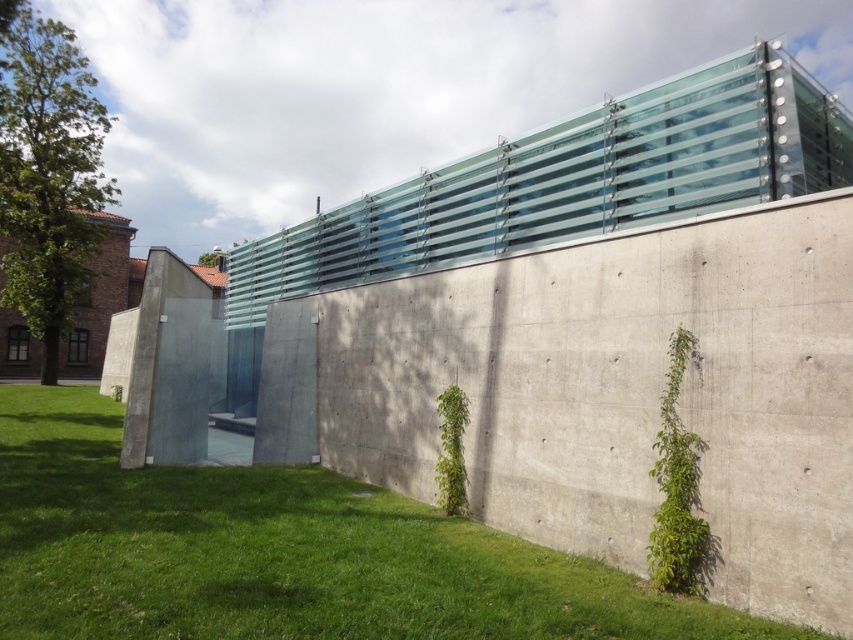
Between green leafy ivy at lower right and green leafy ivy at center, which one appears on the right side from the viewer's perspective?

green leafy ivy at lower right

From the picture: Which is below, green leafy ivy at lower right or green leafy ivy at center?

green leafy ivy at center is lower down.

Which is in front, point (689, 492) or point (445, 413)?

Point (689, 492) is in front.

The height and width of the screenshot is (640, 853). Identify the location of green leafy ivy at lower right. (677, 490).

Is point (238, 500) positioned behind point (437, 412)?

No.

Who is positioned more to the right, green grass at lower left or green leafy ivy at center?

green leafy ivy at center

The height and width of the screenshot is (640, 853). I want to click on green grass at lower left, so click(280, 552).

Identify the location of green grass at lower left. The width and height of the screenshot is (853, 640). 280,552.

Consider the image. Who is taller, green grass at lower left or green leafy ivy at lower right?

With more height is green leafy ivy at lower right.

Looking at this image, does green grass at lower left have a lesser width compared to green leafy ivy at lower right?

No.

Is point (187, 628) positioned after point (682, 580)?

No, it is not.

The width and height of the screenshot is (853, 640). What are the coordinates of `green grass at lower left` in the screenshot? It's located at (280, 552).